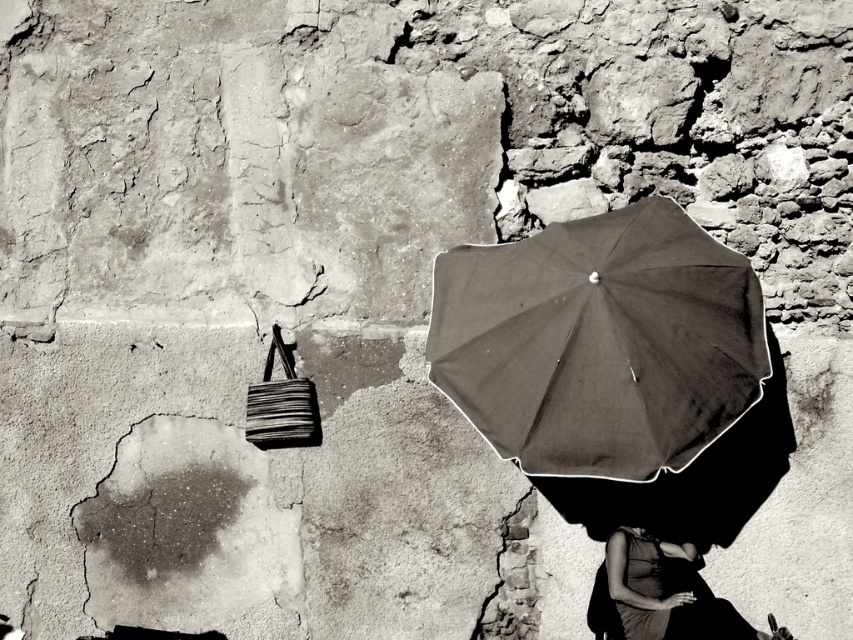
Does point (592, 413) lie behind point (630, 552)?

That is False.

Which is behind, point (544, 243) or point (670, 595)?

Positioned behind is point (544, 243).

The height and width of the screenshot is (640, 853). Describe the element at coordinates (599, 342) in the screenshot. I see `dark matte umbrella at center` at that location.

This screenshot has height=640, width=853. I want to click on dark matte umbrella at center, so click(599, 342).